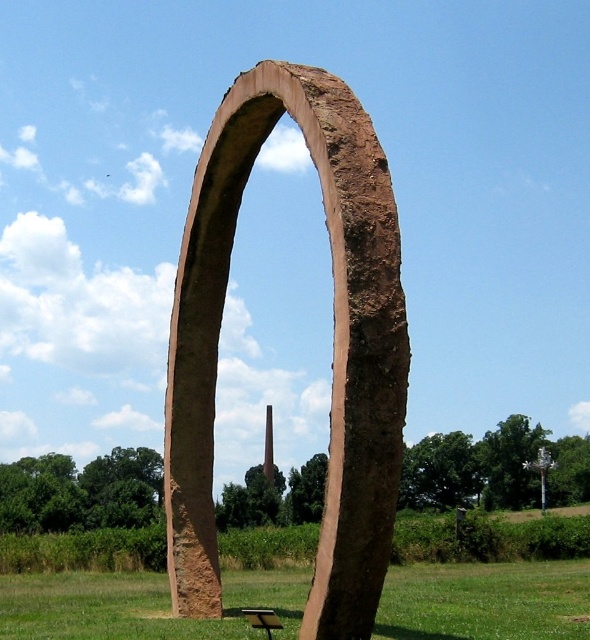
Question: Is the position of green grass at center less distant than that of brown wooden picnic table at lower center?

Choices:
 (A) no
 (B) yes

Answer: (B)

Question: Which point is closer to the camera taking this photo?

Choices:
 (A) (270, 636)
 (B) (329, 468)

Answer: (B)

Question: Is green grass at center in front of brown wooden picnic table at lower center?

Choices:
 (A) no
 (B) yes

Answer: (B)

Question: Among these points, which one is farthest from the camera?

Choices:
 (A) (276, 621)
 (B) (241, 172)

Answer: (B)

Question: Which object is farther from the camera taking this photo?

Choices:
 (A) green grass at center
 (B) brown stone arch at center
 (C) brown wooden picnic table at lower center

Answer: (C)

Question: Is green grass at center smaller than brown wooden picnic table at lower center?

Choices:
 (A) no
 (B) yes

Answer: (A)